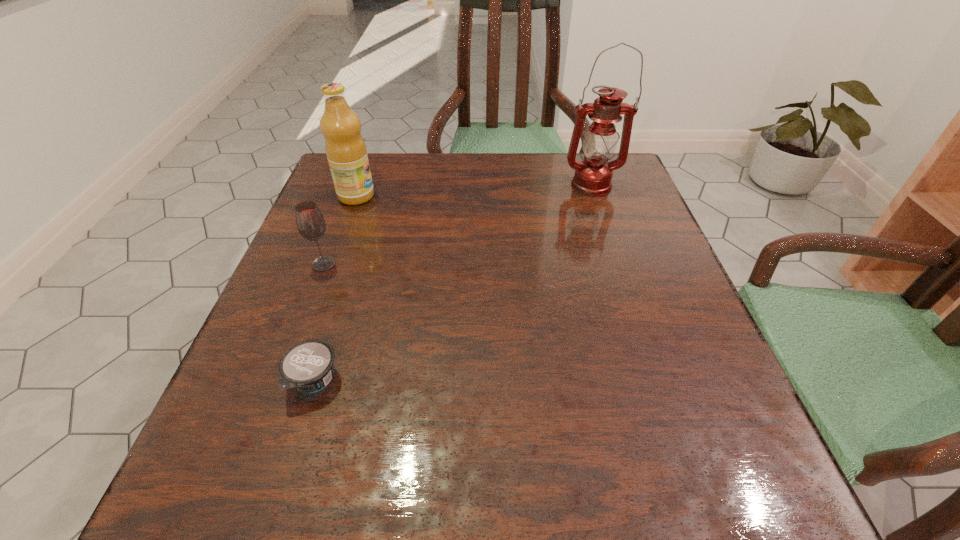
You are a GUI agent. You are given a task and a screenshot of the screen. Output one action in this format:
    pyautogui.click(x=<x>, y=<y>)
    Task: Click on the blank space located 0.050m on the front of the shortest object
    
    Given the screenshot: What is the action you would take?
    pos(296,440)

Find the location of a particular element. oil lamp that is at the far edge is located at coordinates (593, 175).

Where is `olive oil situated at the far edge`? olive oil situated at the far edge is located at coordinates pos(345,148).

Where is `olive oil positioned at the left edge`? Image resolution: width=960 pixels, height=540 pixels. olive oil positioned at the left edge is located at coordinates 345,148.

You are a GUI agent. You are given a task and a screenshot of the screen. Output one action in this format:
    pyautogui.click(x=<x>, y=<y>)
    Task: Click on the glass drink container positioned at the left edge
    Image resolution: width=960 pixels, height=540 pixels.
    Given the screenshot: What is the action you would take?
    pyautogui.click(x=311, y=225)

At what (x,y) coordinates should I click in order to perform the action: click on yogurt that is at the left edge. Please return your answer as a coordinate pair (x, y). Looking at the image, I should click on (307, 366).

This screenshot has width=960, height=540. In order to click on object located in the right edge section of the desktop in this screenshot , I will do `click(593, 175)`.

The height and width of the screenshot is (540, 960). Identify the location of object situated at the far left corner. (345, 148).

Where is `object present at the far right corner`? The width and height of the screenshot is (960, 540). object present at the far right corner is located at coordinates (593, 175).

Locate an element on the screen. The height and width of the screenshot is (540, 960). free spot at the far edge of the desktop is located at coordinates (397, 201).